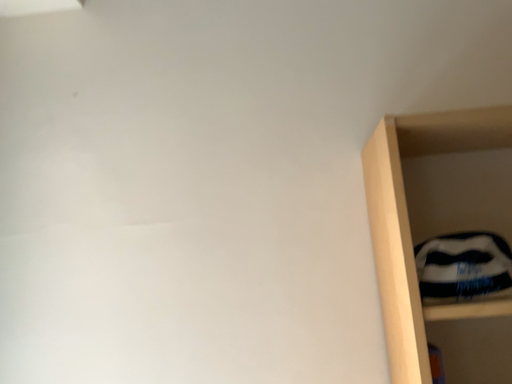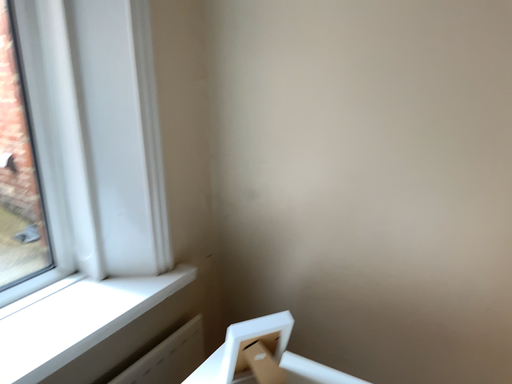
Question: Which way did the camera rotate in the video?

Choices:
 (A) rotated upward
 (B) rotated downward

Answer: (B)